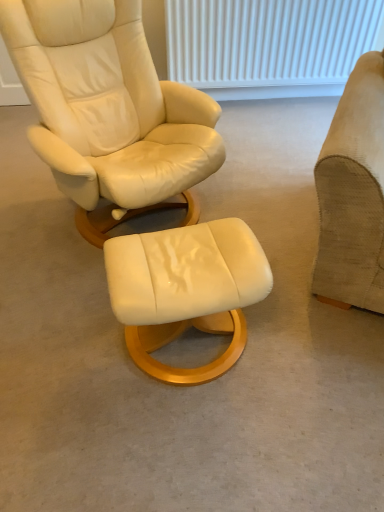
Locate an element on the screen. Image resolution: width=384 pixels, height=512 pixels. suede beige armchair at right is located at coordinates (353, 193).

Identify the location of matte cream leather stool at center. Image resolution: width=384 pixels, height=512 pixels. (186, 290).

Where is `white textured radiator at upper center`? The width and height of the screenshot is (384, 512). white textured radiator at upper center is located at coordinates (269, 44).

Does suede beige armchair at right turn towards matte cream leather stool at center?

No, suede beige armchair at right is not oriented towards matte cream leather stool at center.

In the image, is suede beige armchair at right on the left side or the right side of matte cream leather stool at center?

In the image, suede beige armchair at right appears on the right side of matte cream leather stool at center.

From a real-world perspective, who is located higher, suede beige armchair at right or matte cream leather stool at center?

suede beige armchair at right is physically above.

How many degrees apart are the facing directions of suede beige armchair at right and matte cream leather stool at center?

36.4 degrees.

From the image's perspective, which is below, white textured radiator at upper center or matte cream leather stool at center?

From the image's view, matte cream leather stool at center is below.

From a real-world perspective, is white textured radiator at upper center positioned over matte cream leather stool at center based on gravity?

Yes, from a real-world perspective, white textured radiator at upper center is above matte cream leather stool at center.

Consider the image. How much distance is there between white textured radiator at upper center and matte cream leather stool at center?

white textured radiator at upper center is 1.87 meters from matte cream leather stool at center.

Do you think white textured radiator at upper center is within matte cream leather stool at center, or outside of it?

white textured radiator at upper center lies outside matte cream leather stool at center.

Does matte cream leather stool at center appear on the right side of suede beige armchair at right?

No, matte cream leather stool at center is not to the right of suede beige armchair at right.

Could you tell me if matte cream leather stool at center is facing suede beige armchair at right?

No.

Does matte cream leather stool at center have a lesser width compared to suede beige armchair at right?

Indeed, matte cream leather stool at center has a lesser width compared to suede beige armchair at right.

Where is `chair lying below the white textured radiator at upper center (from the image's perspective)`? Image resolution: width=384 pixels, height=512 pixels. chair lying below the white textured radiator at upper center (from the image's perspective) is located at coordinates (353, 193).

Considering the sizes of objects suede beige armchair at right and white textured radiator at upper center in the image provided, who is thinner, suede beige armchair at right or white textured radiator at upper center?

white textured radiator at upper center is thinner.

Considering the positions of points (369, 234) and (304, 18), is point (369, 234) farther from camera compared to point (304, 18)?

No, (369, 234) is in front of (304, 18).

Is suede beige armchair at right closer to the viewer compared to white textured radiator at upper center?

Yes, the depth of suede beige armchair at right is less than that of white textured radiator at upper center.

From a real-world perspective, between white textured radiator at upper center and suede beige armchair at right, who is vertically higher?

suede beige armchair at right.

Is white textured radiator at upper center far away from suede beige armchair at right?

Yes, white textured radiator at upper center is far from suede beige armchair at right.

Is suede beige armchair at right a part of white textured radiator at upper center?

No, white textured radiator at upper center does not contain suede beige armchair at right.

In the image, is white textured radiator at upper center on the left side or the right side of suede beige armchair at right?

In the image, white textured radiator at upper center appears on the left side of suede beige armchair at right.

Does matte cream leather stool at center touch white textured radiator at upper center?

There is a gap between matte cream leather stool at center and white textured radiator at upper center.

Is point (200, 271) closer to viewer compared to point (216, 20)?

Yes, it is in front of point (216, 20).

Considering the sizes of objects matte cream leather stool at center and white textured radiator at upper center in the image provided, who is bigger, matte cream leather stool at center or white textured radiator at upper center?

Bigger between the two is white textured radiator at upper center.

Which object is wider, matte cream leather stool at center or white textured radiator at upper center?

matte cream leather stool at center.

Where is `chair on the right of matte cream leather stool at center`? This screenshot has width=384, height=512. chair on the right of matte cream leather stool at center is located at coordinates [x=353, y=193].

At what (x,y) coordinates should I click in order to perform the action: click on radiator positioned vertically above the matte cream leather stool at center (from a real-world perspective). Please return your answer as a coordinate pair (x, y). Looking at the image, I should click on (269, 44).

Estimate the real-world distances between objects in this image. Which object is further from suede beige armchair at right, white textured radiator at upper center or matte cream leather stool at center?

white textured radiator at upper center is positioned further to the anchor suede beige armchair at right.

Which object lies further to the anchor point white textured radiator at upper center, suede beige armchair at right or matte cream leather stool at center?

Based on the image, matte cream leather stool at center appears to be further to white textured radiator at upper center.

From the picture: Considering their positions, is white textured radiator at upper center positioned closer to matte cream leather stool at center than suede beige armchair at right?

Among the two, suede beige armchair at right is located nearer to matte cream leather stool at center.

Estimate the real-world distances between objects in this image. Which object is closer to white textured radiator at upper center, matte cream leather stool at center or suede beige armchair at right?

Based on the image, suede beige armchair at right appears to be nearer to white textured radiator at upper center.

Based on their spatial positions, is suede beige armchair at right or white textured radiator at upper center further from matte cream leather stool at center?

white textured radiator at upper center is further to matte cream leather stool at center.

Estimate the real-world distances between objects in this image. Which object is further from suede beige armchair at right, matte cream leather stool at center or white textured radiator at upper center?

Based on the image, white textured radiator at upper center appears to be further to suede beige armchair at right.

Identify the location of stool between suede beige armchair at right and white textured radiator at upper center from front to back. (186, 290).